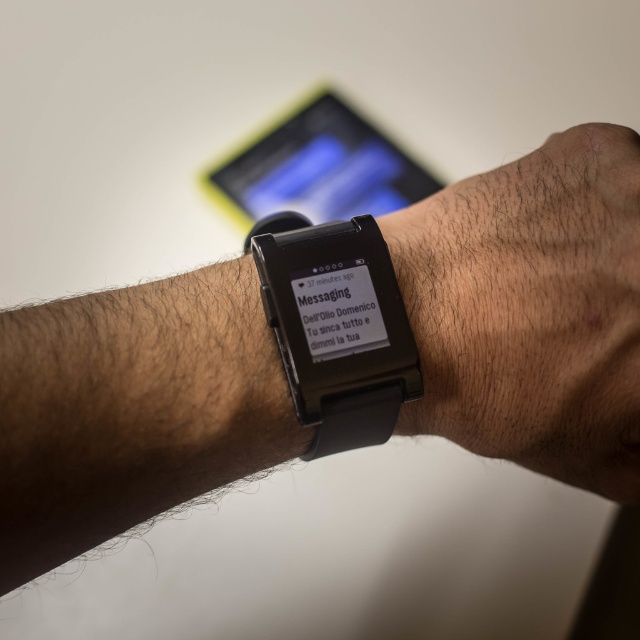
Does black rubber watch at center lie behind black matte smartwatch at center?

No, it is not.

Is black rubber watch at center smaller than black matte smartwatch at center?

Indeed, black rubber watch at center has a smaller size compared to black matte smartwatch at center.

Which is behind, point (264, 294) or point (308, 106)?

Point (308, 106)

Identify the location of black rubber watch at center. (337, 326).

I want to click on black matte watch at center, so click(531, 308).

Between black matte watch at center and black matte smartwatch at center, which one appears on the right side from the viewer's perspective?

black matte watch at center is more to the right.

In order to click on black matte watch at center in this screenshot , I will do `click(531, 308)`.

Can you confirm if black matte watch at center is bigger than black rubber watch at center?

Yes.

Which is behind, point (426, 218) or point (371, 392)?

Positioned behind is point (426, 218).

Who is more distant from viewer, (444, 400) or (333, 339)?

The point (444, 400) is more distant.

Find the location of `black matte watch at center`. black matte watch at center is located at coordinates (531, 308).